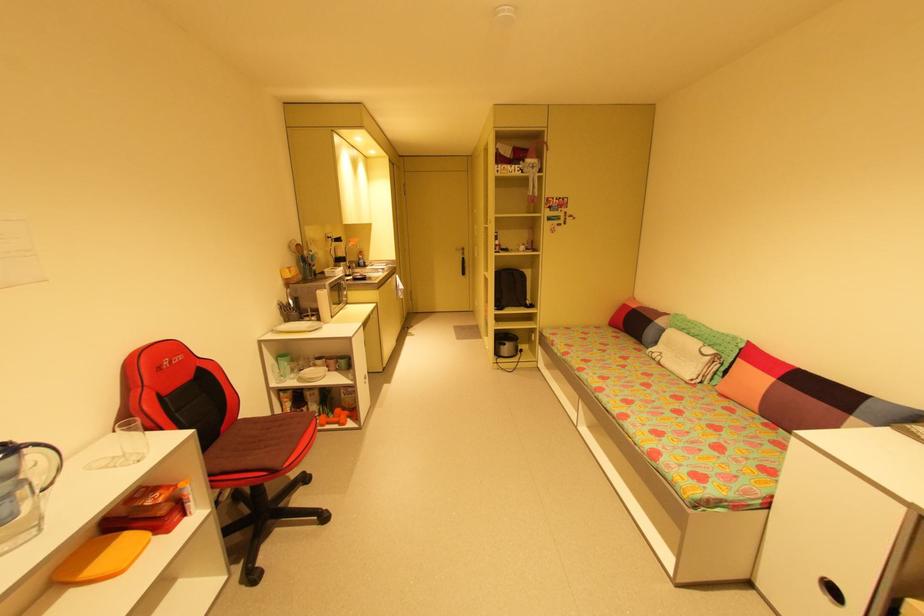
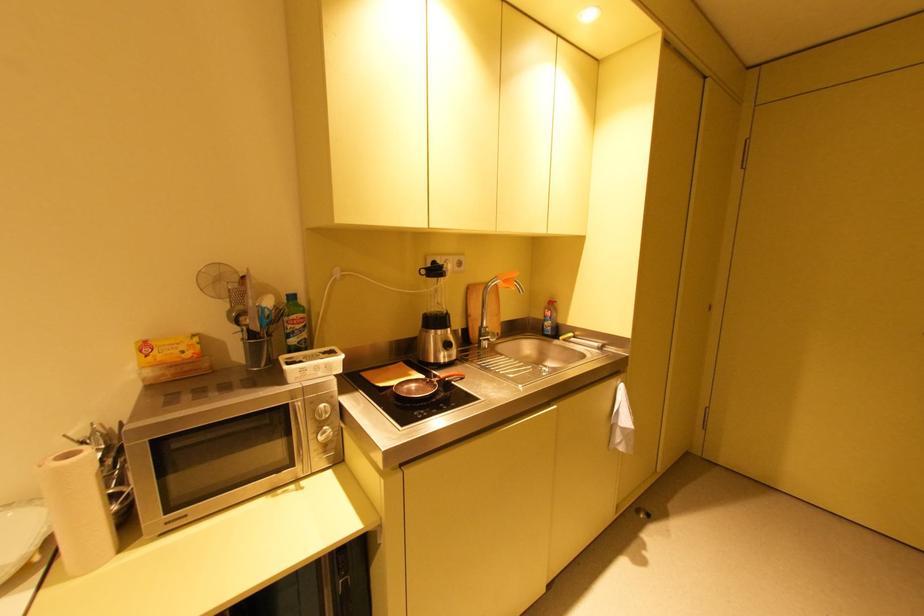
Find the pixel in the second image that matches pixel 349 262 in the first image.

(444, 331)